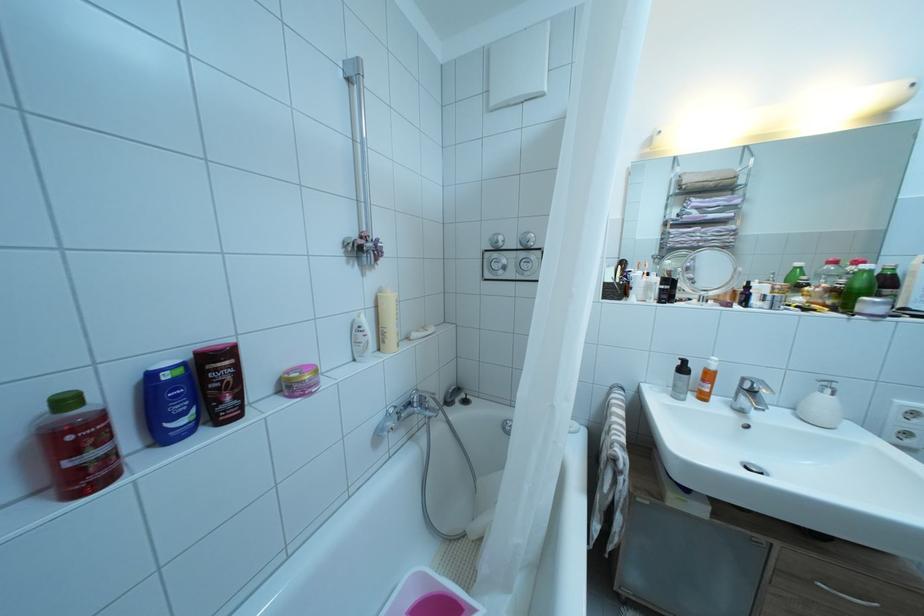
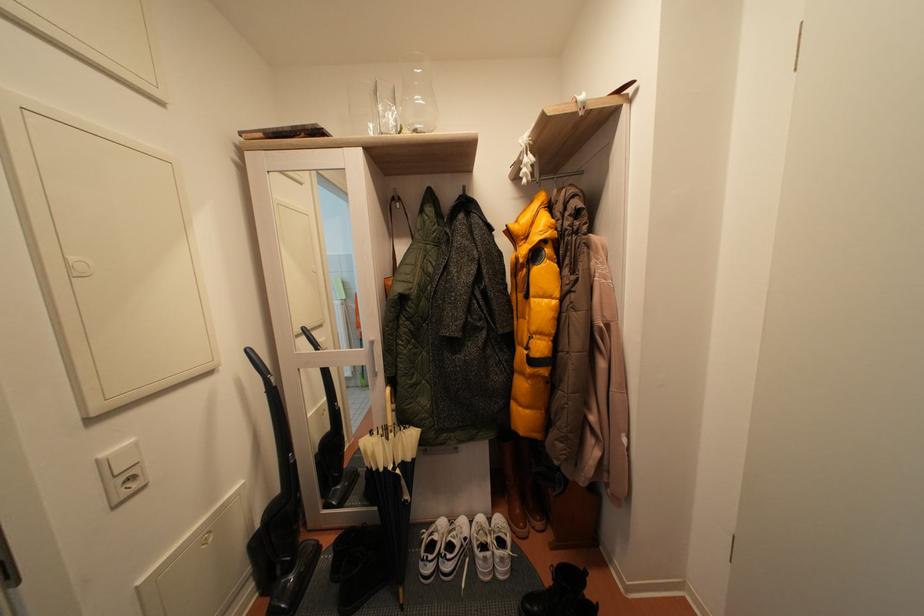
Consider the image. What movement of the cameraman would produce the second image?

The cameraman walked toward right, backward.